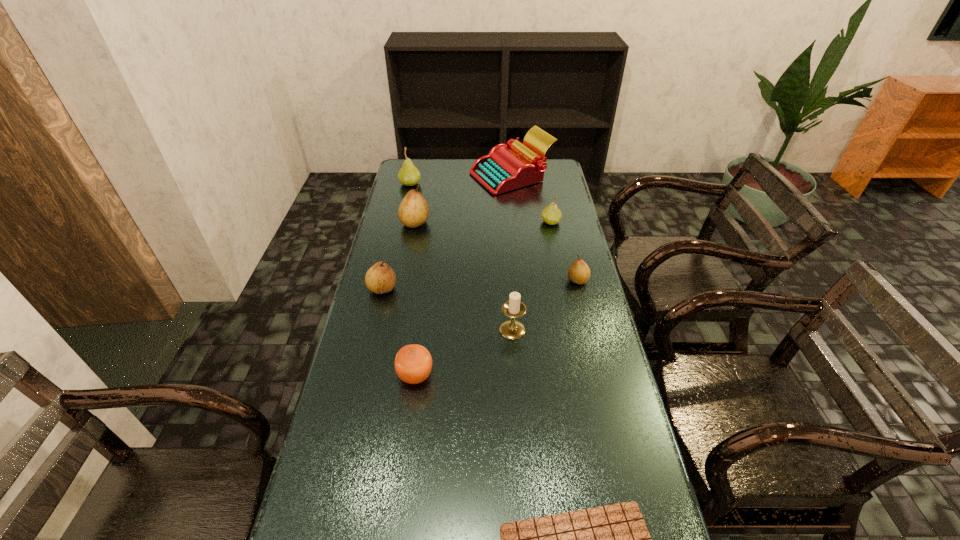
You are a GUI agent. You are given a task and a screenshot of the screen. Output one action in this format:
    pyautogui.click(x=<x>, y=<y>)
    Task: Click on the vacant space situated on the left of the right green pear
    This screenshot has width=960, height=540.
    Given the screenshot: What is the action you would take?
    pyautogui.click(x=523, y=222)

Identify the location of vacant space located 0.140m on the front of the orange orange. Image resolution: width=960 pixels, height=540 pixels. (407, 441).

Locate an element on the screen. The height and width of the screenshot is (540, 960). vacant space located 0.180m on the front of the smallest brown pear is located at coordinates (589, 328).

The image size is (960, 540). I want to click on typewriter at the far edge, so click(507, 167).

You are a GUI agent. You are given a task and a screenshot of the screen. Output one action in this format:
    pyautogui.click(x=<x>, y=<y>)
    Task: Click on the pear located at the far edge
    This screenshot has height=540, width=960.
    Given the screenshot: What is the action you would take?
    pyautogui.click(x=409, y=175)

Identify the location of orange that is at the left edge. The width and height of the screenshot is (960, 540). (413, 363).

The height and width of the screenshot is (540, 960). In order to click on typewriter positioned at the right edge in this screenshot , I will do `click(507, 167)`.

You are a GUI agent. You are given a task and a screenshot of the screen. Output one action in this format:
    pyautogui.click(x=<x>, y=<y>)
    Task: Click on the object that is at the far left corner
    The width and height of the screenshot is (960, 540).
    Given the screenshot: What is the action you would take?
    pyautogui.click(x=409, y=175)

Find the location of a particular element. object that is at the far right corner is located at coordinates (507, 167).

Find the location of a particular element. free region at the far edge of the desktop is located at coordinates (457, 166).